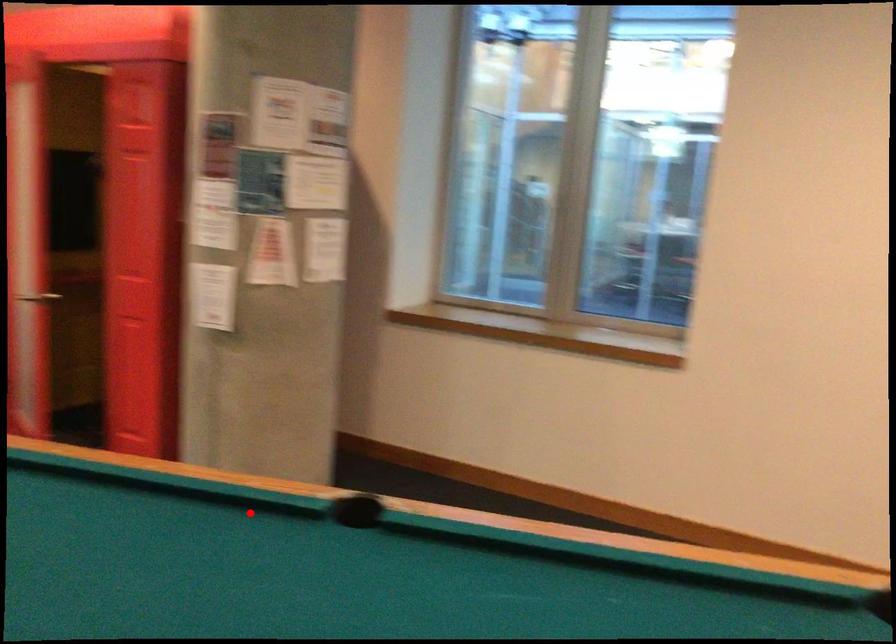
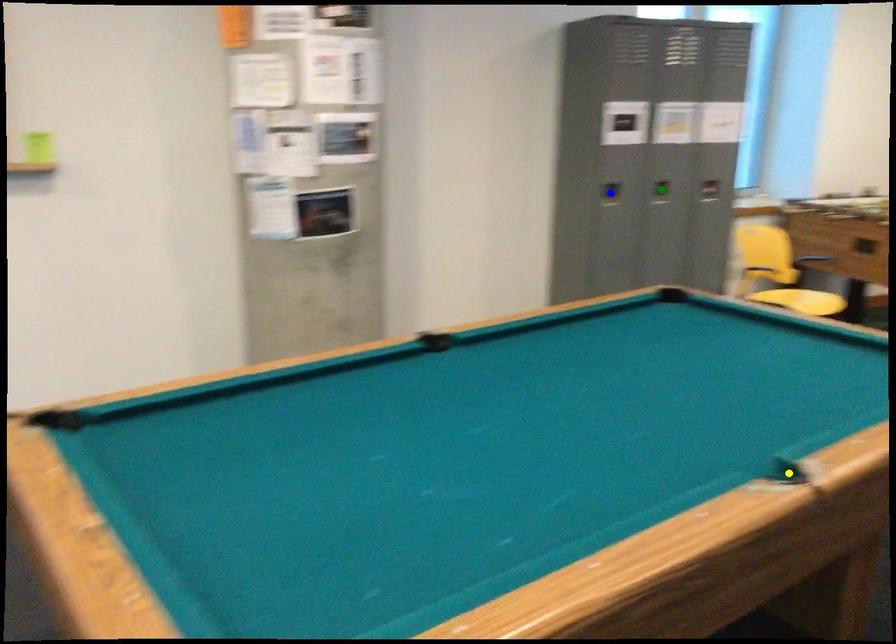
Question: I am providing you with two images of the same scene from different viewpoints. A red point is marked on the first image. You are given multiple points on the second image. Which point in image 2 is actually the same real-world point as the red point in image 1?

Choices:
 (A) yellow point
 (B) blue point
 (C) green point

Answer: (A)